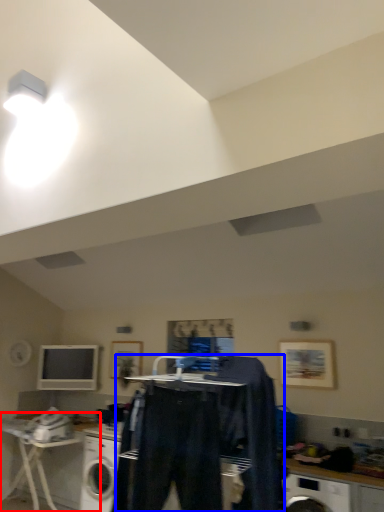
Question: Which object appears farthest to the camera in this image, table (highlighted by a red box) or clothing (highlighted by a blue box)?

Choices:
 (A) table
 (B) clothing

Answer: (A)